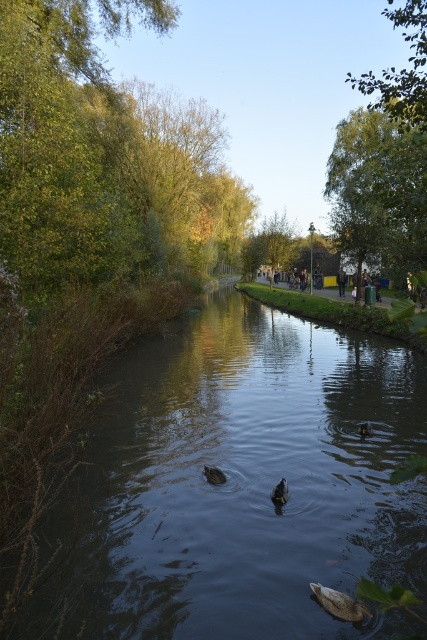
From the picture: Who is taller, dark brown water at center or green leafy tree at right?

green leafy tree at right is taller.

Can you confirm if dark brown water at center is wider than green leafy tree at right?

Incorrect, dark brown water at center's width does not surpass green leafy tree at right's.

Between point (315, 369) and point (348, 182), which one is positioned behind?

Point (348, 182)

I want to click on dark brown water at center, so click(x=239, y=484).

Does dark brown feathers at center come in front of brown fuzzy duck at center?

Yes, dark brown feathers at center is closer to the viewer.

Is dark brown feathers at center further to camera compared to brown fuzzy duck at center?

No, it is in front of brown fuzzy duck at center.

The width and height of the screenshot is (427, 640). What do you see at coordinates (280, 492) in the screenshot? I see `dark brown feathers at center` at bounding box center [280, 492].

You are a GUI agent. You are given a task and a screenshot of the screen. Output one action in this format:
    pyautogui.click(x=<x>, y=<y>)
    Task: Click on the dark brown feathers at center
    
    Given the screenshot: What is the action you would take?
    280,492

Consider the image. Which is below, green leafy tree at right or brown matte duck at lower center?

brown matte duck at lower center

Is point (347, 136) positioned in front of point (350, 609)?

No, it is not.

Locate an element on the screen. green leafy tree at right is located at coordinates (379, 193).